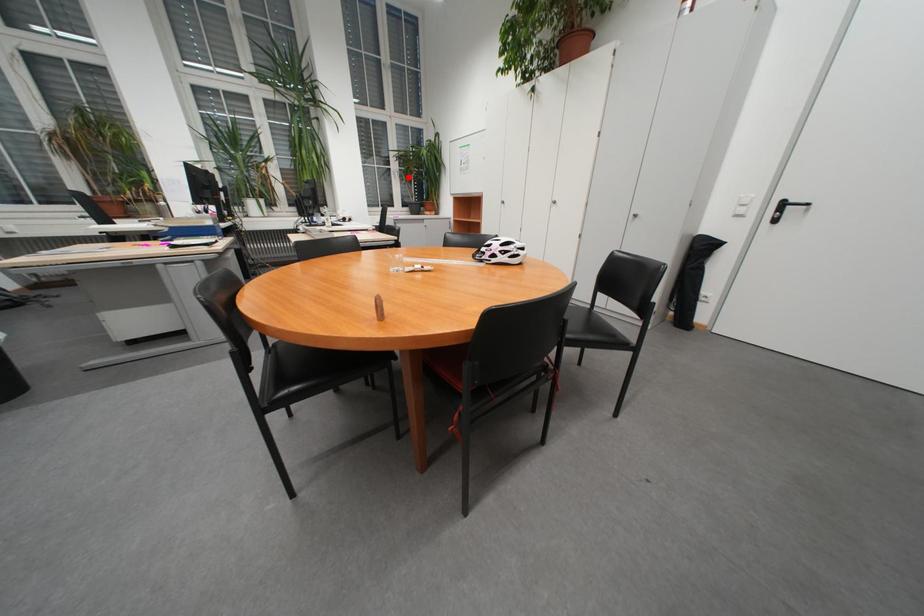
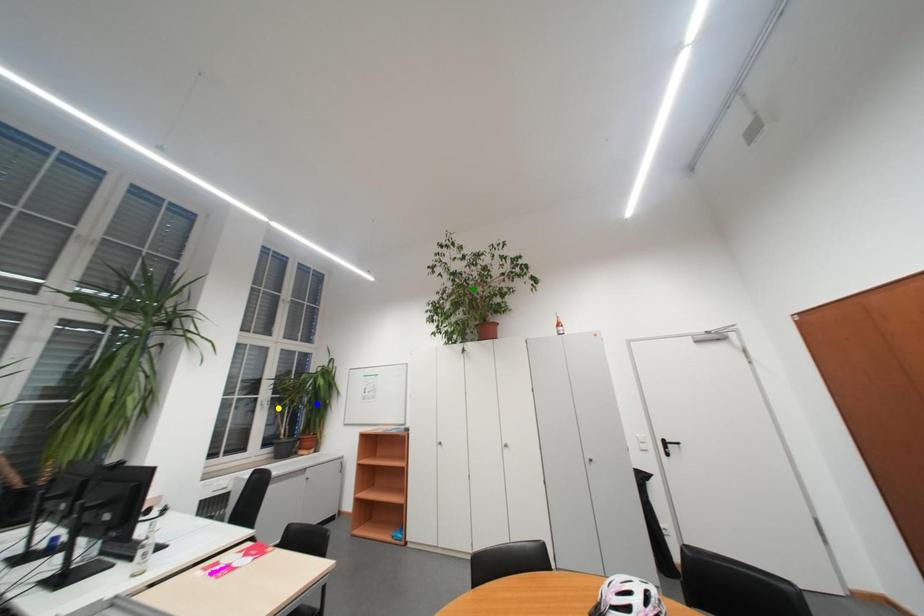
Question: I am providing you with two images of the same scene from different viewpoints. A red point is marked on the first image. You are given multiple points on the second image. Which mark in image 2 goes with the point in image 1?

Choices:
 (A) blue point
 (B) green point
 (C) yellow point

Answer: (C)